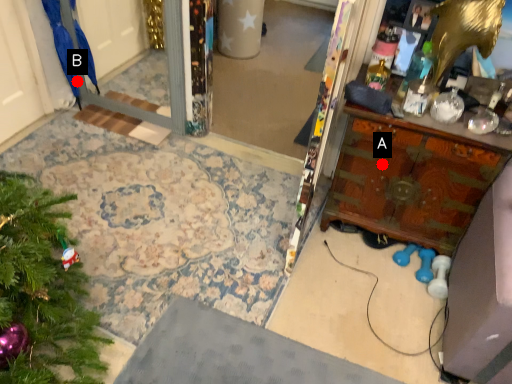
Question: Two points are circled on the image, labeled by A and B beside each circle. Which point is farther from the camera taking this photo?

Choices:
 (A) A is further
 (B) B is further

Answer: (B)